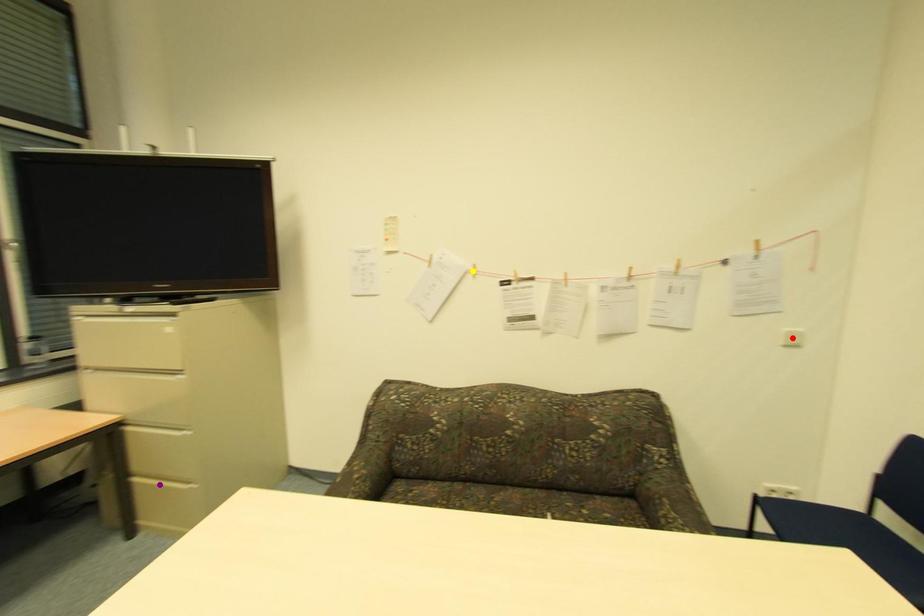
Order these from nearest to farthest:
red point | yellow point | purple point

red point < purple point < yellow point